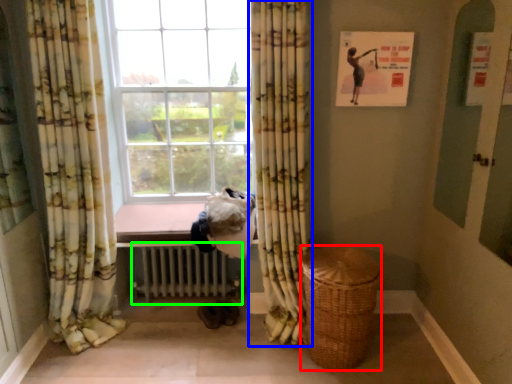
Question: Which object is positioned farthest from basket (highlighted by a red box)? Select from curtain (highlighted by a blue box) and radiator (highlighted by a green box).

Choices:
 (A) curtain
 (B) radiator

Answer: (B)